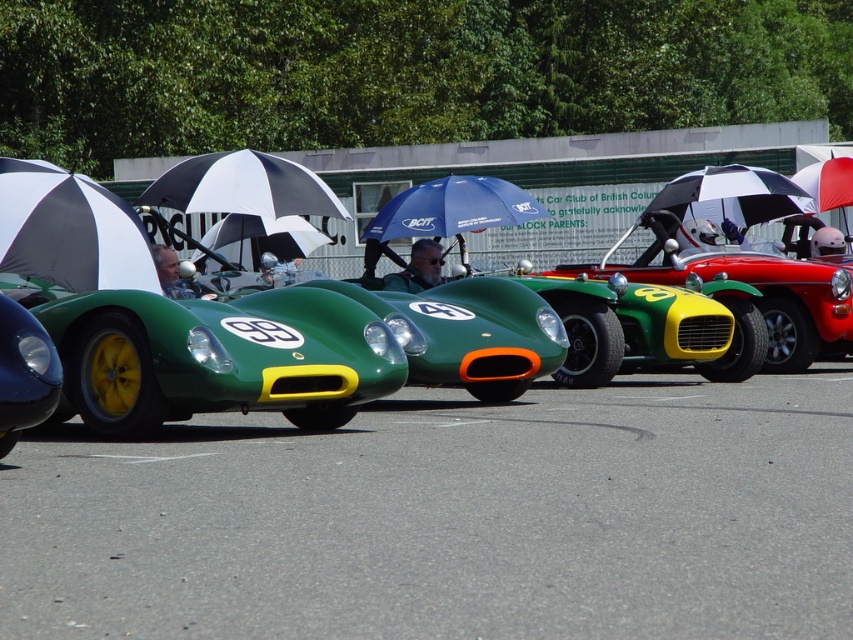
Who is positioned more to the right, black and white striped umbrella at center or shiny blue car at lower left?

black and white striped umbrella at center is more to the right.

Between point (282, 180) and point (28, 400), which one is positioned in front?

Positioned in front is point (28, 400).

Does point (223, 173) lie in front of point (6, 433)?

No, (223, 173) is behind (6, 433).

At what (x,y) coordinates should I click in order to perform the action: click on black and white striped umbrella at center. Please return your answer as a coordinate pair (x, y). The height and width of the screenshot is (640, 853). Looking at the image, I should click on (242, 186).

Is black and white checkered umbrella at center positioned behind matte black helmet at center?

Yes.

Is point (712, 212) closer to viewer compared to point (193, 296)?

No, (712, 212) is further to viewer.

Where is `black and white checkered umbrella at center`? This screenshot has height=640, width=853. black and white checkered umbrella at center is located at coordinates (732, 195).

Based on the photo, can you confirm if black and white striped umbrella at center is wider than white and black striped umbrella at center?

Correct, the width of black and white striped umbrella at center exceeds that of white and black striped umbrella at center.

Who is taller, black and white striped umbrella at center or white and black striped umbrella at center?

With more height is black and white striped umbrella at center.

Where is `black and white striped umbrella at center`? The width and height of the screenshot is (853, 640). black and white striped umbrella at center is located at coordinates (242, 186).